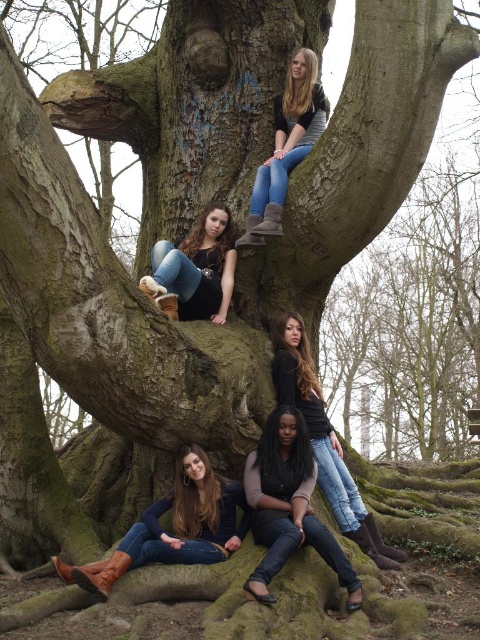
Question: In this image, where is matte black sweater at center located relative to denim jeans at upper center?

Choices:
 (A) left
 (B) right

Answer: (B)

Question: Among these objects, which one is farthest from the camera?

Choices:
 (A) brown leather boots at lower center
 (B) dark brown leather boots at lower center
 (C) matte black boots at center

Answer: (C)

Question: Which of these objects is positioned farthest from the denim jeans at upper center?

Choices:
 (A) brown leather boots at lower center
 (B) matte black boots at center
 (C) dark brown leather boots at lower center
 (D) matte black sweater at center

Answer: (A)

Question: Is dark brown leather boots at lower center positioned in front of matte black boots at center?

Choices:
 (A) no
 (B) yes

Answer: (B)

Question: Does matte black sweater at center have a greater width compared to matte black boots at center?

Choices:
 (A) yes
 (B) no

Answer: (A)

Question: Which point is closer to the camera?

Choices:
 (A) denim jeans at upper center
 (B) matte black sweater at center
 (C) brown leather boots at lower center
 (D) dark brown leather boots at lower center

Answer: (D)